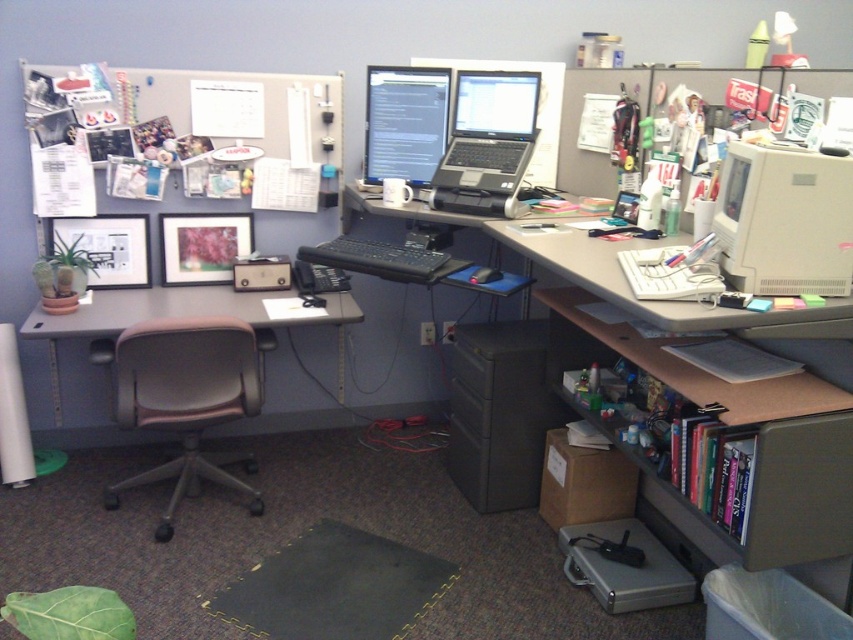
Between gray fabric swivel chair at lower left and brown leather desk at center, which one appears on the right side from the viewer's perspective?

From the viewer's perspective, gray fabric swivel chair at lower left appears more on the right side.

Based on the photo, does gray fabric swivel chair at lower left lie in front of brown leather desk at center?

Yes, gray fabric swivel chair at lower left is closer to the viewer.

Find the location of a particular element. This screenshot has width=853, height=640. gray fabric swivel chair at lower left is located at coordinates (186, 400).

Where is `gray fabric swivel chair at lower left`? gray fabric swivel chair at lower left is located at coordinates (186, 400).

Is gray fabric swivel chair at lower left to the left of white plastic monitor at upper right from the viewer's perspective?

Correct, you'll find gray fabric swivel chair at lower left to the left of white plastic monitor at upper right.

Is gray fabric swivel chair at lower left shorter than white plastic monitor at upper right?

In fact, gray fabric swivel chair at lower left may be taller than white plastic monitor at upper right.

Where is `gray fabric swivel chair at lower left`? Image resolution: width=853 pixels, height=640 pixels. gray fabric swivel chair at lower left is located at coordinates (186, 400).

Does matte black monitor at center come behind black plastic laptop at center?

Yes.

Does matte black monitor at center have a larger size compared to black plastic laptop at center?

No.

Where is `matte black monitor at center`? The image size is (853, 640). matte black monitor at center is located at coordinates (405, 122).